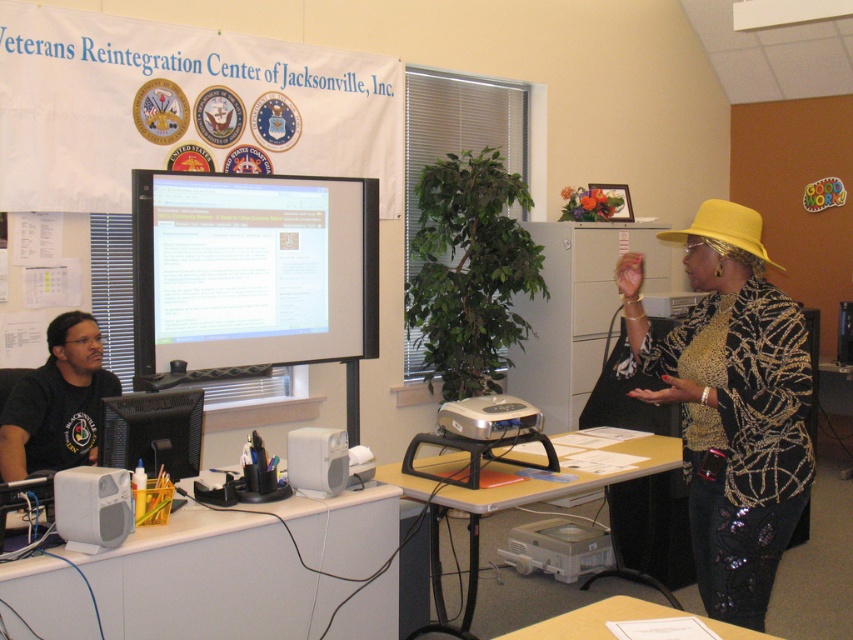
You are attending a meeting at the Veterans Reintegration Center of Jacksonville, Inc. You need to place a document on the white plastic table at lower left and then move to the yellow fabric hat at upper right to adjust it. Can you reach both items without moving your position?

The white plastic table at lower left is positioned on the left side of the yellow fabric hat at upper right, so you can reach both items without moving your position as they are adjacent to each other.

You are attending a meeting at the Veterans Reintegration Center of Jacksonville, Inc. You need to place a name tag on the white plastic table at lower left and the yellow fabric hat at upper right. Which object requires a larger name tag to fit properly?

The white plastic table at lower left requires a larger name tag because its width is greater than the yellow fabric hat at upper right.